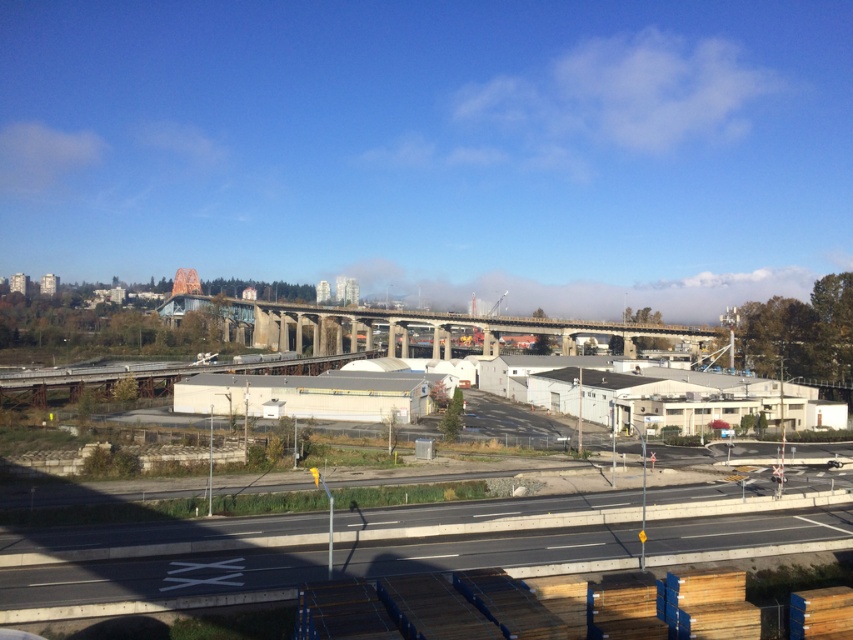
Is smooth asphalt highway at lower center smaller than gray concrete train track at lower center?

Yes, smooth asphalt highway at lower center is smaller than gray concrete train track at lower center.

Is smooth asphalt highway at lower center closer to the viewer compared to gray concrete train track at lower center?

Yes, smooth asphalt highway at lower center is closer to the viewer.

Image resolution: width=853 pixels, height=640 pixels. Describe the element at coordinates (154, 576) in the screenshot. I see `smooth asphalt highway at lower center` at that location.

Find the location of `smooth asphalt highway at lower center`. smooth asphalt highway at lower center is located at coordinates (154, 576).

Who is positioned more to the left, smooth asphalt highway at lower center or concrete bridge at center?

From the viewer's perspective, concrete bridge at center appears more on the left side.

Does point (828, 536) come closer to viewer compared to point (277, 337)?

Yes, it is in front of point (277, 337).

Does point (810, 508) lie in front of point (339, 324)?

Yes, point (810, 508) is in front of point (339, 324).

Find the location of a particular element. smooth asphalt highway at lower center is located at coordinates (154, 576).

Does concrete bridge at center have a lesser width compared to gray concrete train track at lower center?

No, concrete bridge at center is not thinner than gray concrete train track at lower center.

Between concrete bridge at center and gray concrete train track at lower center, which one appears on the right side from the viewer's perspective?

concrete bridge at center

Locate an element on the screen. concrete bridge at center is located at coordinates (412, 326).